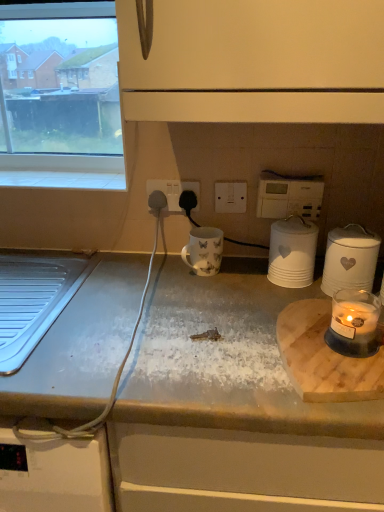
The height and width of the screenshot is (512, 384). What are the coordinates of `free space that is to the left of white matte canister at center-right, placed as the second kitchen appliance when sorted from right to left` in the screenshot? It's located at (230, 287).